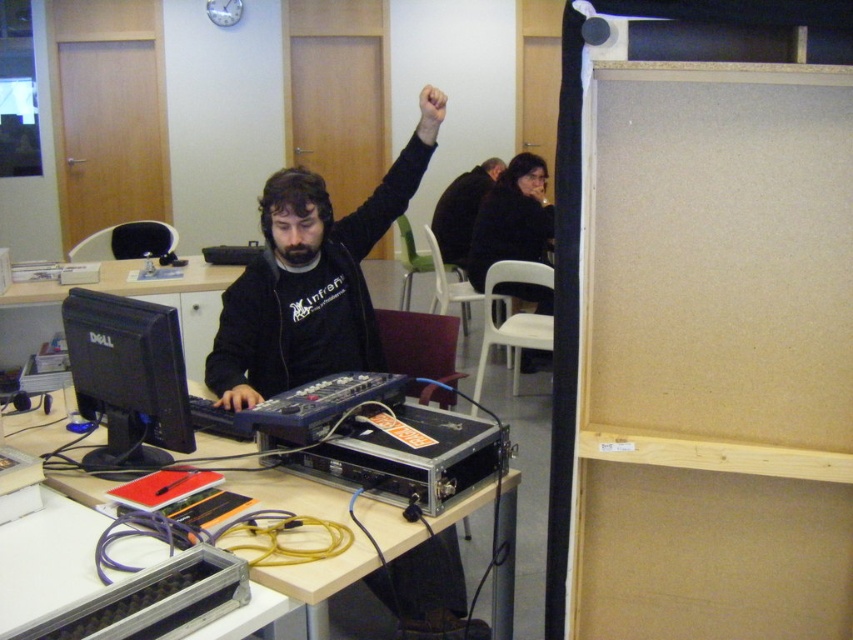
Consider the image. You are a delivery person who needs to place a package between the black matte jacket at center and the dark brown leather jacket at upper center. The package requires a space of 3 meters. Is there enough space between them?

The black matte jacket at center and dark brown leather jacket at upper center are 2.83 meters apart, so there is not enough space to place the package requiring 3 meters between them.

You are an interior designer planning to place a new lamp on the desk. The lamp requires a specific placement at coordinates between 0.8 and 0.9 on the x and y axes. Can the metallic silver table at center accommodate this lamp?

The metallic silver table at center is positioned at point [370,544], so the lamp can be placed there as it falls within the required coordinates between 0.8 and 0.9 on both axes.